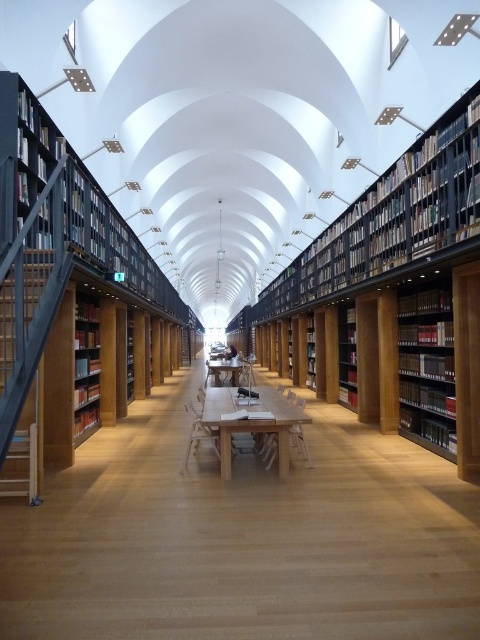
Question: Which point is farther to the camera?

Choices:
 (A) (83, 337)
 (B) (0, 378)

Answer: (A)

Question: In this image, where is dark gray wood bookshelf at left located relative to wooden table at center?

Choices:
 (A) left
 (B) right

Answer: (A)

Question: Is dark gray wood bookshelf at left to the left of white wooden table at center from the viewer's perspective?

Choices:
 (A) yes
 (B) no

Answer: (A)

Question: Which point is farther to the camera?

Choices:
 (A) (347, 356)
 (B) (94, 308)
 (C) (20, 378)
 (D) (288, 428)

Answer: (A)

Question: Is white wooden table at center to the right of wooden bookshelf at left from the viewer's perspective?

Choices:
 (A) yes
 (B) no

Answer: (A)

Question: Which of the following is the farthest from the observer?

Choices:
 (A) dark gray wood bookshelf at left
 (B) matte black bookshelf at right

Answer: (B)